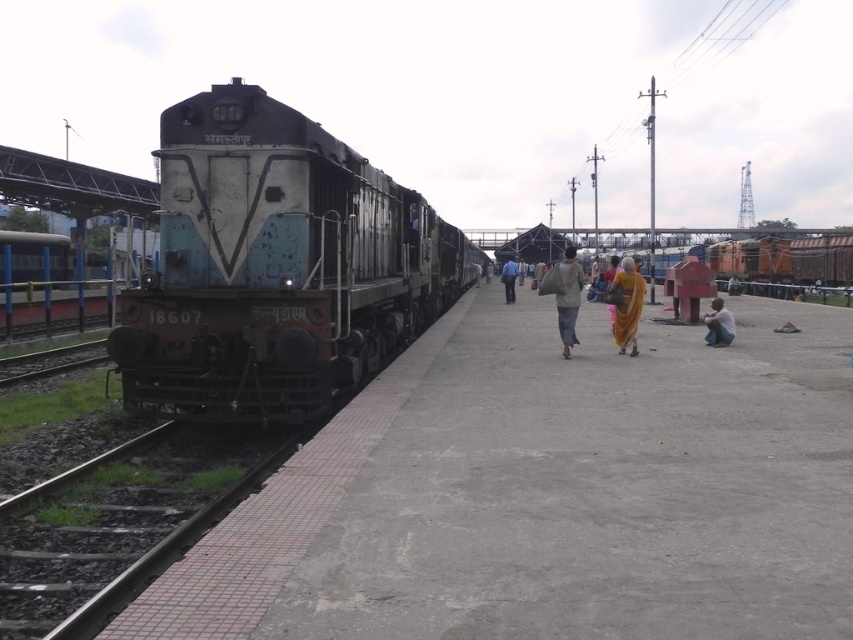
Question: Which is nearer to the matte pink sari at center?

Choices:
 (A) blue fabric bag at center
 (B) metallic blue train at left

Answer: (A)

Question: Estimate the real-world distances between objects in this image. Which object is closer to the light brown fabric bag at lower right?

Choices:
 (A) matte pink sari at center
 (B) dirty metal train at center
 (C) light brown fabric bag at center
 (D) metallic blue train at left

Answer: (A)

Question: In this image, where is light brown fabric bag at center located relative to light brown fabric bag at lower right?

Choices:
 (A) below
 (B) above

Answer: (B)

Question: Is dirty metal train at center wider than blue fabric bag at center?

Choices:
 (A) yes
 (B) no

Answer: (A)

Question: Does matte pink sari at center come behind blue fabric bag at center?

Choices:
 (A) yes
 (B) no

Answer: (B)

Question: Which point appears farthest from the camera in this image?

Choices:
 (A) (421, 227)
 (B) (270, 467)
 (C) (33, 259)
 (D) (621, 332)

Answer: (C)